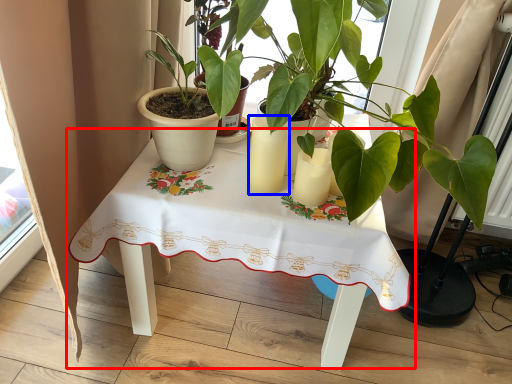
Question: Which object appears closest to the camera in this image, table (highlighted by a red box) or candle holder (highlighted by a blue box)?

Choices:
 (A) table
 (B) candle holder

Answer: (A)